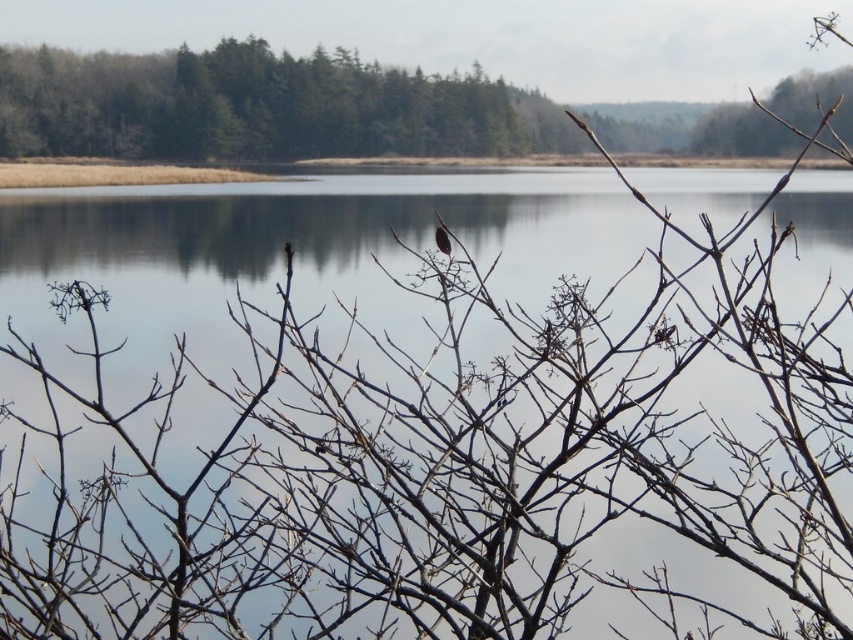
Question: Is transparent water at center positioned behind brown matte bird at center?

Choices:
 (A) yes
 (B) no

Answer: (B)

Question: Can you confirm if transparent water at center is wider than brown matte bird at center?

Choices:
 (A) no
 (B) yes

Answer: (B)

Question: Is transparent water at center smaller than brown matte bird at center?

Choices:
 (A) yes
 (B) no

Answer: (B)

Question: Which point is closer to the camera?

Choices:
 (A) transparent water at center
 (B) brown matte bird at center

Answer: (A)